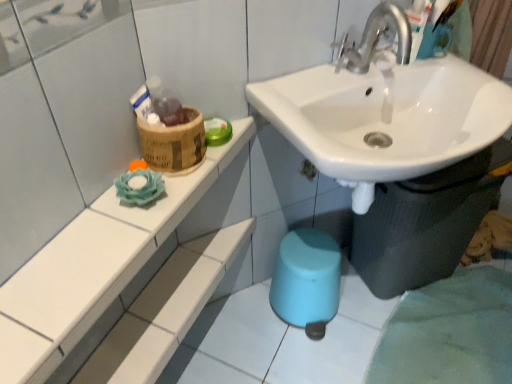
The image size is (512, 384). In order to click on vacant space underneath white ceramic shelf at upper left (from a real-world perspective) in this screenshot , I will do 170,296.